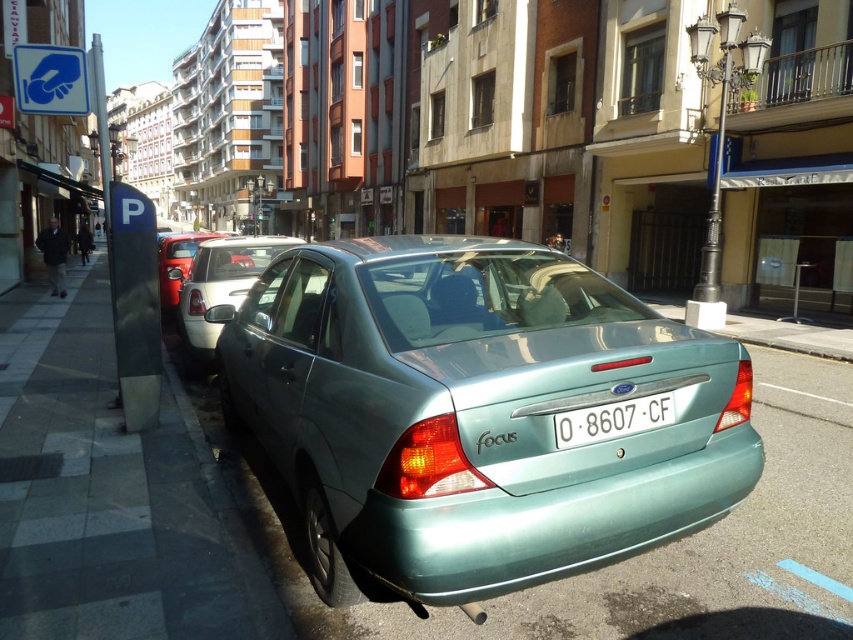
You are standing at the point labeled point (225, 305) and want to walk to the point labeled point (648, 388). Which direction should you face to walk towards your destination?

You should face towards the direction away from the camera because point (648, 388) is closer to the camera than point (225, 305).

You are a delivery person trying to park your van between the metallic teal sedan at center and the metallic silver sedan at center. Your van is 2.1 meters wide. Can you fit your van between them?

The metallic teal sedan at center is thinner than the metallic silver sedan at center, but the exact distance between them isn not provided. Without knowing the space between the two sedans, it is impossible to determine if the van will fit.

You are a delivery person trying to park your motorcycle between the metallic teal sedan at center and the gray concrete sidewalk at lower left. Can your motorcycle, which is 1.2 meters wide, fit in the space between them?

The metallic teal sedan at center is thinner than the gray concrete sidewalk at lower left, so the space between them is at least as wide as the sedan. Since the motorcycle is 1.2 meters wide, it depends on the exact width of the space. However, the description only states the sedan is thinner than the sidewalk, not the distance between them. Therefore, we cannot confirm if the motorcycle will fit without more information about the actual space width.